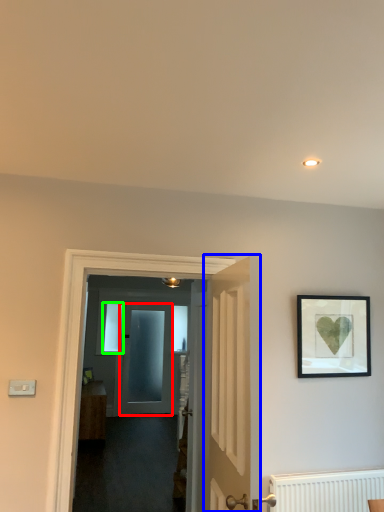
Question: Which is nearer to the door (highlighted by a red box)? door (highlighted by a blue box) or window (highlighted by a green box).

Choices:
 (A) door
 (B) window

Answer: (B)